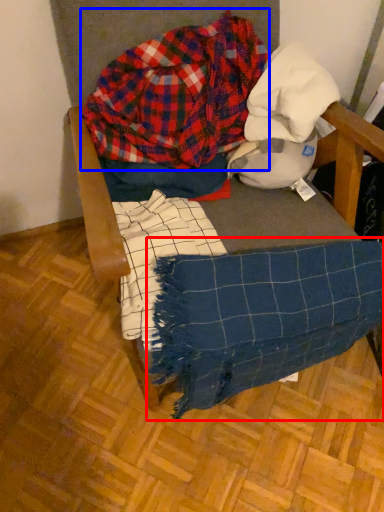
Question: Among these objects, which one is farthest to the camera, blanket (highlighted by a red box) or flannel (highlighted by a blue box)?

Choices:
 (A) blanket
 (B) flannel

Answer: (B)